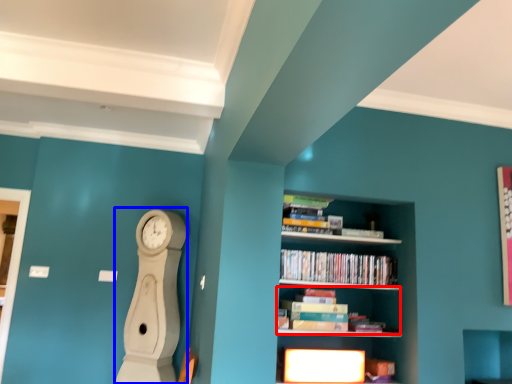
Question: Which point is further to the camera, book (highlighted by a red box) or clock (highlighted by a blue box)?

Choices:
 (A) book
 (B) clock

Answer: (B)